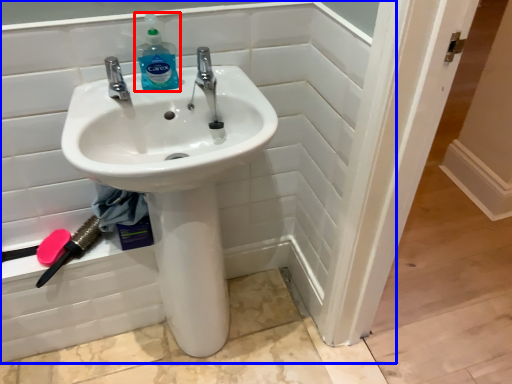
Question: Among these objects, which one is farthest to the camera, cleaning product (highlighted by a red box) or bath (highlighted by a blue box)?

Choices:
 (A) cleaning product
 (B) bath

Answer: (A)